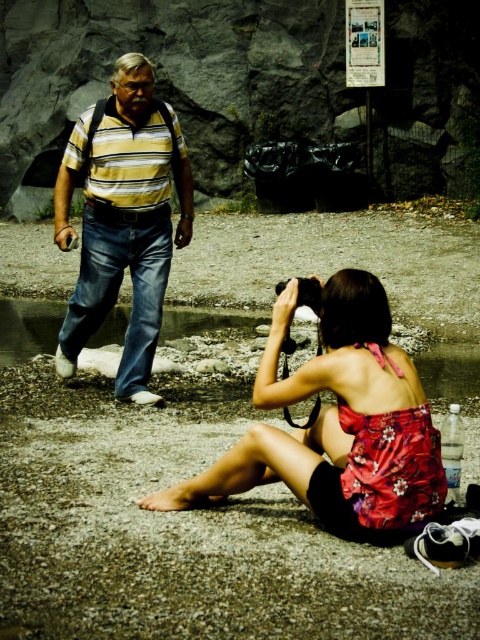
You are a photographer trying to decide where to place your equipment. You have a striped cotton shirt at left and a black plastic camera at center. Which item should you move if you want to free up more space?

The striped cotton shirt at left is larger in size than the black plastic camera at center, so moving the striped cotton shirt at left would free up more space.

You are a photographer trying to position yourself between the striped cotton shirt at left and the floral fabric bikini top at lower center to capture both in the frame. Which direction should you move to ensure both objects are visible in your shot?

To capture both the striped cotton shirt at left and the floral fabric bikini top at lower center in your frame, you should position yourself to the right of the floral fabric bikini top at lower center so that the striped cotton shirt at left is to your left and the floral fabric bikini top at lower center is centered or to your right.